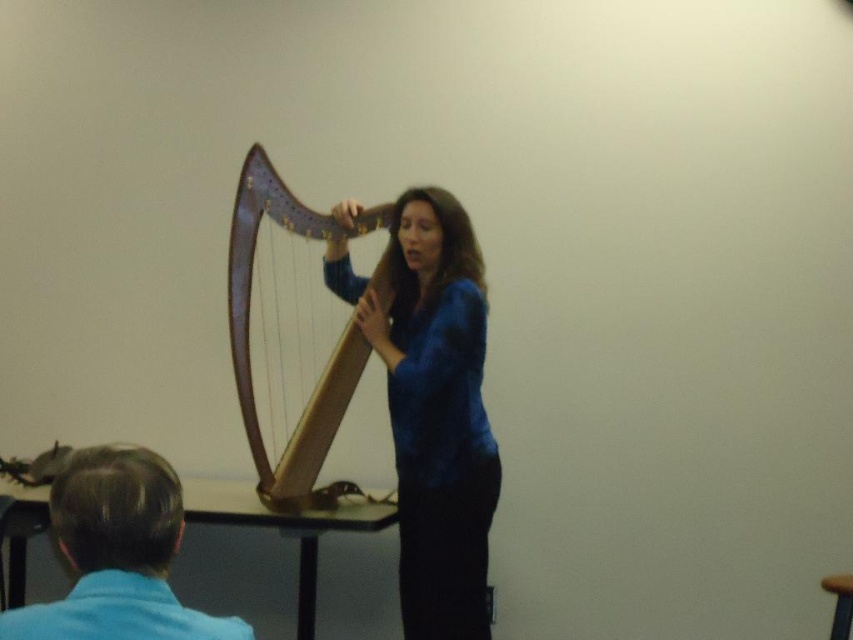
You are a photographer setting up for a photo shoot in the room. You need to place a small lamp between the blue fabric shirt at lower left and the brown wood stool at lower right. Based on their positions, where should you place the lamp to ensure it is between them?

The blue fabric shirt at lower left is positioned on the left side of brown wood stool at lower right, so you should place the lamp to the right of the blue fabric shirt at lower left and to the left of the brown wood stool at lower right to ensure it is between them.